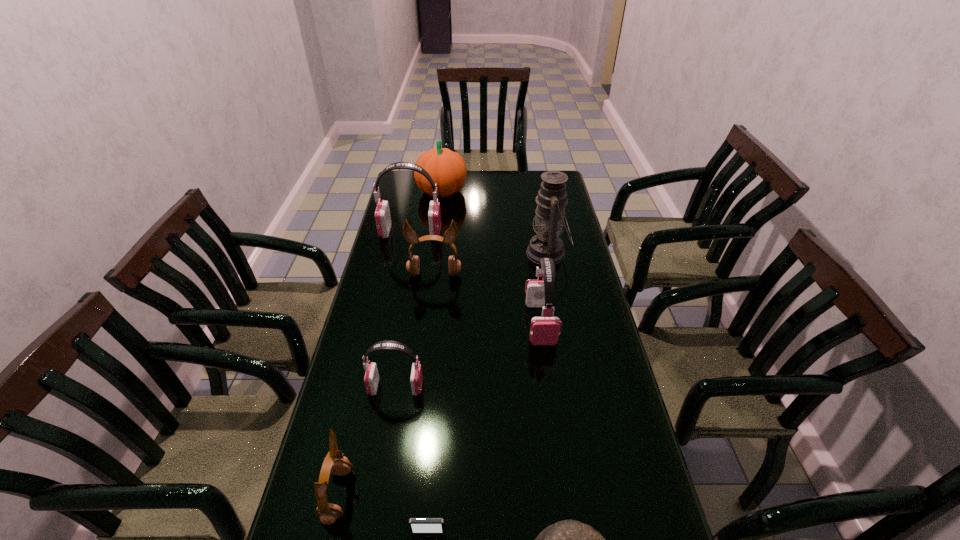
What are the coordinates of `the third nearest object` in the screenshot? It's located at (328, 513).

The height and width of the screenshot is (540, 960). Identify the location of the nearest pink earphone. (371, 379).

Locate an element on the screen. the fourth nearest object is located at coordinates (371, 379).

The width and height of the screenshot is (960, 540). I want to click on vacant space located on the back of the oil lamp, so click(541, 221).

In order to click on free location located on the outer surface of the biggest pink earphone in this screenshot , I will do `click(535, 233)`.

The height and width of the screenshot is (540, 960). I want to click on vacant area located on the back of the farthest object, so click(x=444, y=174).

Identify the location of free space located on the front-facing side of the right brown earphone. (430, 309).

Locate an element on the screen. vacant point located 0.350m on the outer surface of the rightmost pink earphone is located at coordinates (560, 458).

Identify the location of free region located on the front-facing side of the nearest earphone. This screenshot has width=960, height=540. (417, 495).

What are the coordinates of `free space located on the outer surface of the fourth nearest object` in the screenshot? It's located at (462, 387).